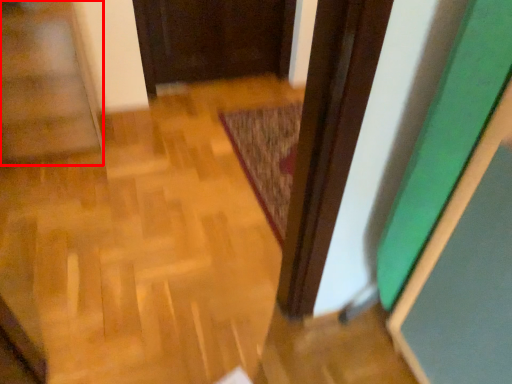
Question: From the image, what is the correct spatial relationship of stairwell (annotated by the red box) in relation to mat?

Choices:
 (A) right
 (B) left

Answer: (B)